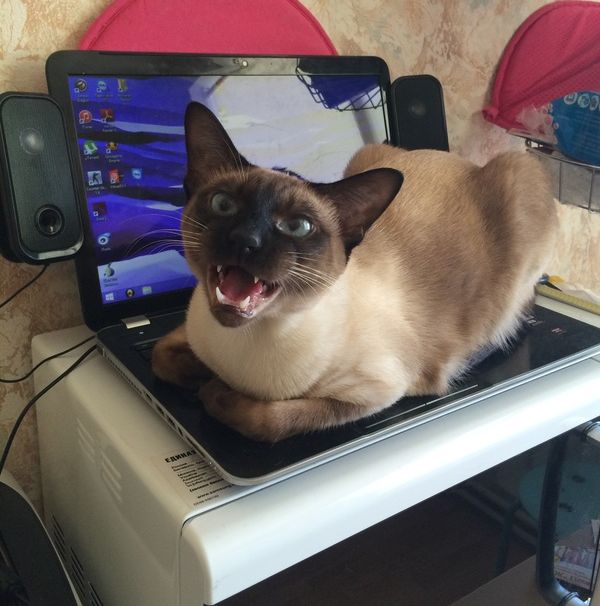
Locate an element on the screen. The image size is (600, 606). laptop is located at coordinates (137, 200), (185, 405).